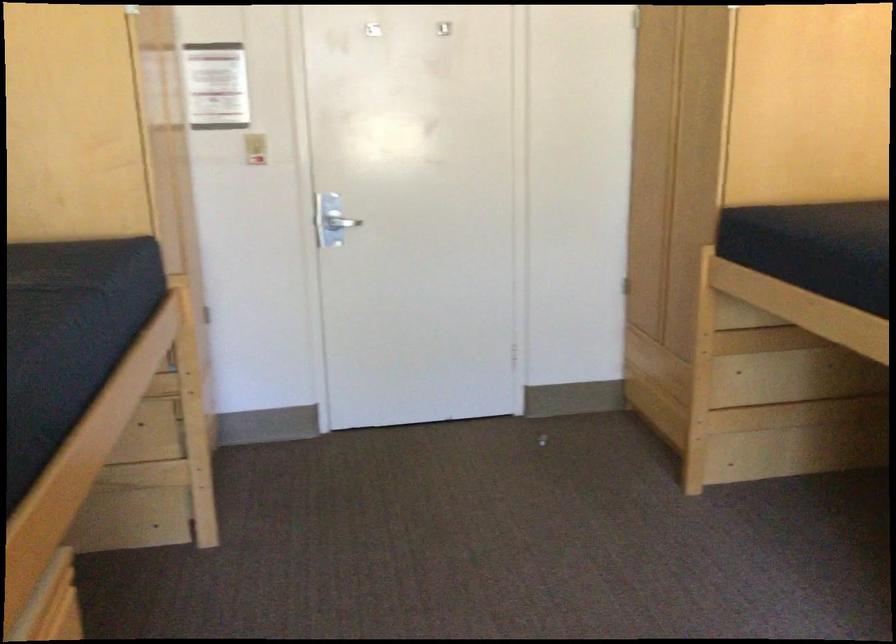
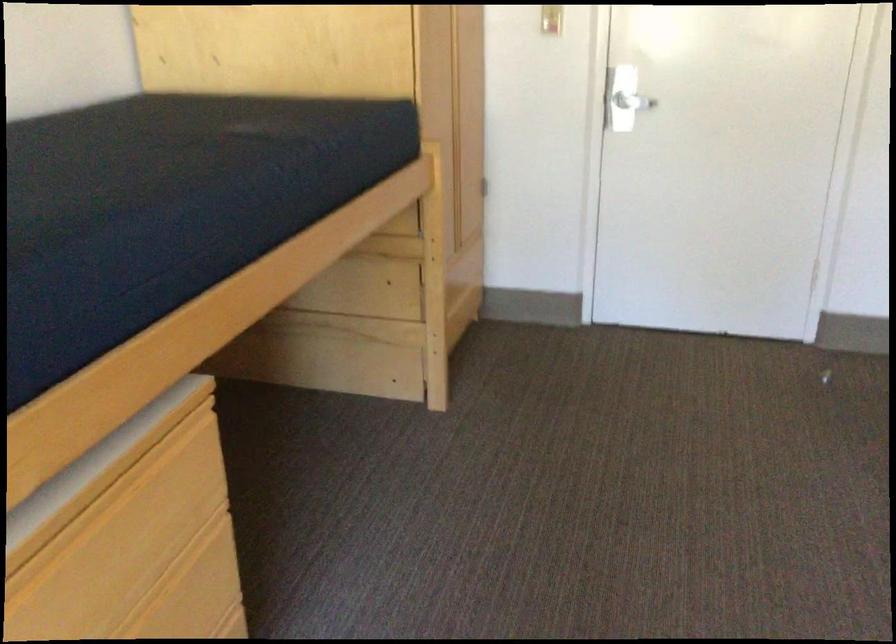
The images are taken continuously from a first-person perspective. In which direction are you moving?

The cameraman moved toward right, forward.